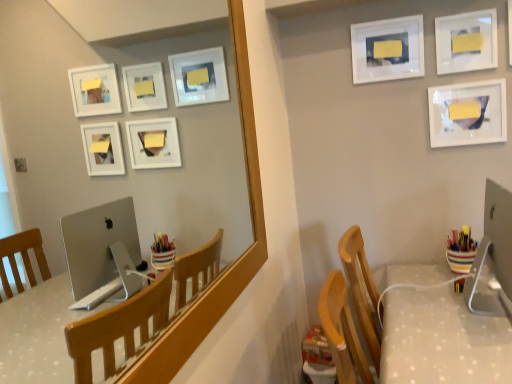
Question: Would you say white glossy picture frame at upper right, which is the 1th picture frame from right to left, is part of matte wooden mirror at upper center's contents?

Choices:
 (A) no
 (B) yes

Answer: (A)

Question: Does matte wooden mirror at upper center have a lesser width compared to white glossy picture frame at upper right, acting as the 3th picture frame starting from the left?

Choices:
 (A) no
 (B) yes

Answer: (B)

Question: Is the depth of matte wooden mirror at upper center less than that of white glossy picture frame at upper right, which is the 1th picture frame from right to left?

Choices:
 (A) yes
 (B) no

Answer: (A)

Question: Is matte wooden mirror at upper center taller than white glossy picture frame at upper right, acting as the 3th picture frame starting from the left?

Choices:
 (A) yes
 (B) no

Answer: (A)

Question: Is the position of matte wooden mirror at upper center more distant than that of white glossy picture frame at upper right, acting as the 3th picture frame starting from the left?

Choices:
 (A) yes
 (B) no

Answer: (B)

Question: Considering the positions of point (457, 268) and point (499, 117), is point (457, 268) closer or farther from the camera than point (499, 117)?

Choices:
 (A) farther
 (B) closer

Answer: (B)

Question: In the image, is multicolored plastic cup at right on the left side or the right side of white glossy picture frame at upper right, acting as the 3th picture frame starting from the left?

Choices:
 (A) right
 (B) left

Answer: (B)

Question: In the image, is multicolored plastic cup at right positioned in front of or behind white glossy picture frame at upper right, acting as the 3th picture frame starting from the left?

Choices:
 (A) front
 (B) behind

Answer: (A)

Question: From the image's perspective, is multicolored plastic cup at right positioned above or below white glossy picture frame at upper right, acting as the 3th picture frame starting from the left?

Choices:
 (A) below
 (B) above

Answer: (A)

Question: From the image's perspective, relative to white glossy picture frame at upper right, acting as the second picture frame starting from the right, is multicolored plastic cup at right above or below?

Choices:
 (A) above
 (B) below

Answer: (B)

Question: In terms of height, does multicolored plastic cup at right look taller or shorter compared to white glossy picture frame at upper right, acting as the second picture frame starting from the right?

Choices:
 (A) tall
 (B) short

Answer: (B)

Question: Is multicolored plastic cup at right wider or thinner than white glossy picture frame at upper right, the 2th picture frame from the left?

Choices:
 (A) thin
 (B) wide

Answer: (B)

Question: Is point (477, 246) closer or farther from the camera than point (495, 39)?

Choices:
 (A) closer
 (B) farther

Answer: (A)

Question: From a real-world perspective, is sleek silver monitor at right positioned above or below multicolored plastic cup at right?

Choices:
 (A) below
 (B) above

Answer: (B)

Question: From the image's perspective, is sleek silver monitor at right above or below multicolored plastic cup at right?

Choices:
 (A) above
 (B) below

Answer: (A)